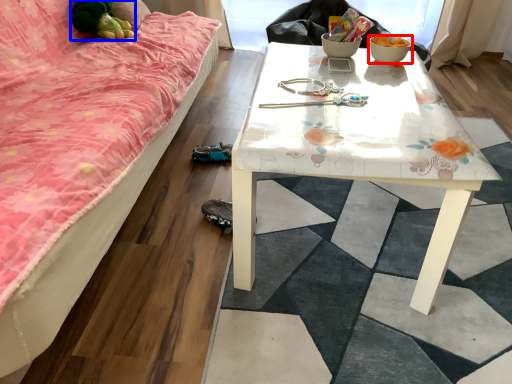
Question: Which object appears closest to the camera in this image, bowl (highlighted by a red box) or toy (highlighted by a blue box)?

Choices:
 (A) bowl
 (B) toy

Answer: (A)